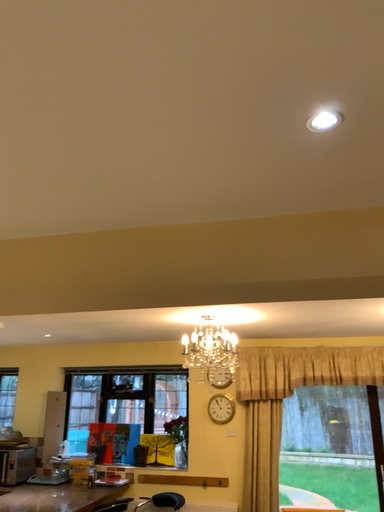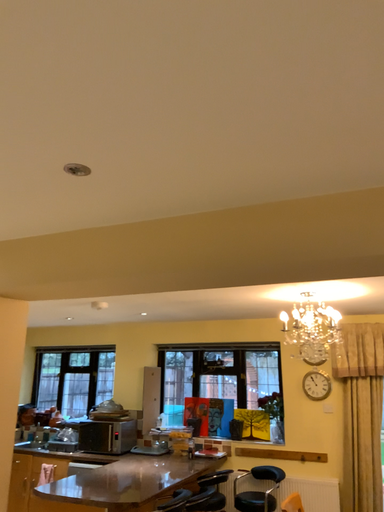
Question: Which way did the camera rotate in the video?

Choices:
 (A) rotated left
 (B) rotated right

Answer: (A)